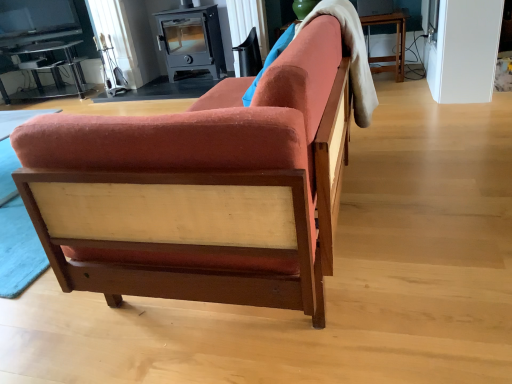
Question: Can you confirm if matte black swivel chair at upper center is positioned to the right of velvet orange couch at center?

Choices:
 (A) yes
 (B) no

Answer: (B)

Question: From the image's perspective, does matte black swivel chair at upper center appear lower than velvet orange couch at center?

Choices:
 (A) yes
 (B) no

Answer: (B)

Question: Does matte black swivel chair at upper center have a lesser width compared to velvet orange couch at center?

Choices:
 (A) yes
 (B) no

Answer: (A)

Question: Is matte black swivel chair at upper center positioned with its back to velvet orange couch at center?

Choices:
 (A) yes
 (B) no

Answer: (B)

Question: From the image's perspective, is matte black swivel chair at upper center over velvet orange couch at center?

Choices:
 (A) no
 (B) yes

Answer: (B)

Question: Would you say metallic wood-burning stove at upper center is inside or outside clear glass table at upper left?

Choices:
 (A) inside
 (B) outside

Answer: (B)

Question: Does point (202, 23) appear closer or farther from the camera than point (53, 64)?

Choices:
 (A) farther
 (B) closer

Answer: (B)

Question: From the image's perspective, is metallic wood-burning stove at upper center located above or below clear glass table at upper left?

Choices:
 (A) above
 (B) below

Answer: (A)

Question: In the image, is metallic wood-burning stove at upper center positioned in front of or behind clear glass table at upper left?

Choices:
 (A) behind
 (B) front

Answer: (B)

Question: Considering the positions of clear glass table at upper left and metallic wood-burning stove at upper center in the image, is clear glass table at upper left bigger or smaller than metallic wood-burning stove at upper center?

Choices:
 (A) small
 (B) big

Answer: (B)

Question: Is clear glass table at upper left to the left or to the right of metallic wood-burning stove at upper center in the image?

Choices:
 (A) left
 (B) right

Answer: (A)

Question: Considering their positions, is clear glass table at upper left located in front of or behind metallic wood-burning stove at upper center?

Choices:
 (A) front
 (B) behind

Answer: (B)

Question: Choose the correct answer: Is clear glass table at upper left inside metallic wood-burning stove at upper center or outside it?

Choices:
 (A) inside
 (B) outside

Answer: (B)

Question: Is metallic wood-burning stove at upper center bigger or smaller than velvet orange couch at center?

Choices:
 (A) big
 (B) small

Answer: (B)

Question: Visually, is metallic wood-burning stove at upper center positioned to the left or to the right of velvet orange couch at center?

Choices:
 (A) left
 (B) right

Answer: (A)